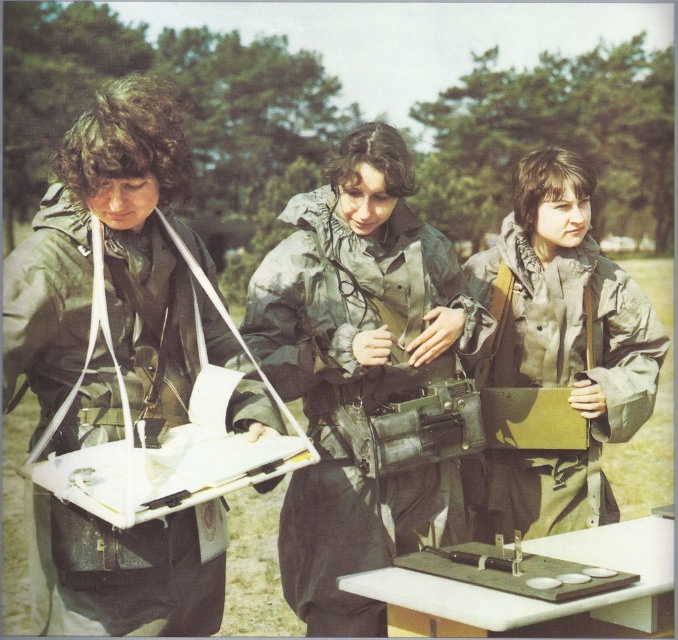
Does green matte jacket at center have a lesser width compared to metallic gray tray at center?

In fact, green matte jacket at center might be wider than metallic gray tray at center.

Based on the photo, is green matte jacket at center shorter than metallic gray tray at center?

In fact, green matte jacket at center may be taller than metallic gray tray at center.

What do you see at coordinates (358, 371) in the screenshot? This screenshot has height=640, width=678. I see `green matte jacket at center` at bounding box center [358, 371].

This screenshot has height=640, width=678. In order to click on green matte jacket at center in this screenshot , I will do `click(358, 371)`.

Between matte green jacket at left and matte green jacket at center, which one has more height?

matte green jacket at left

Based on the photo, does matte green jacket at left have a smaller size compared to matte green jacket at center?

Actually, matte green jacket at left might be larger than matte green jacket at center.

Is point (39, 627) in front of point (521, 465)?

That is True.

At what (x,y) coordinates should I click in order to perform the action: click on matte green jacket at left. Please return your answer as a coordinate pair (x, y). Looking at the image, I should click on click(106, 260).

Who is shorter, matte green jacket at center or metallic gray tray at center?

With less height is metallic gray tray at center.

Is matte green jacket at center to the left of metallic gray tray at center from the viewer's perspective?

In fact, matte green jacket at center is to the right of metallic gray tray at center.

Is point (603, 506) positioned before point (555, 580)?

No.

Where is `matte green jacket at center`? This screenshot has height=640, width=678. matte green jacket at center is located at coordinates point(557,348).